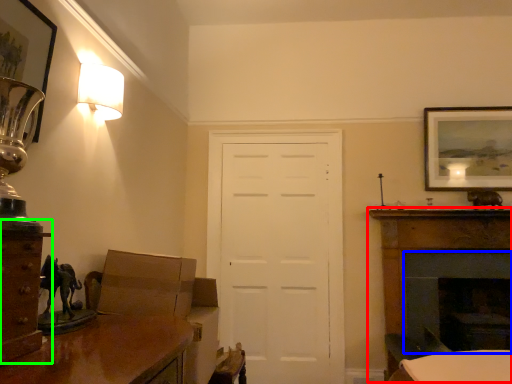
Question: Which object is the farthest from fireplace (highlighted by a red box)? Choose among these: fireplace (highlighted by a blue box) or cabinetry (highlighted by a green box).

Choices:
 (A) fireplace
 (B) cabinetry

Answer: (B)